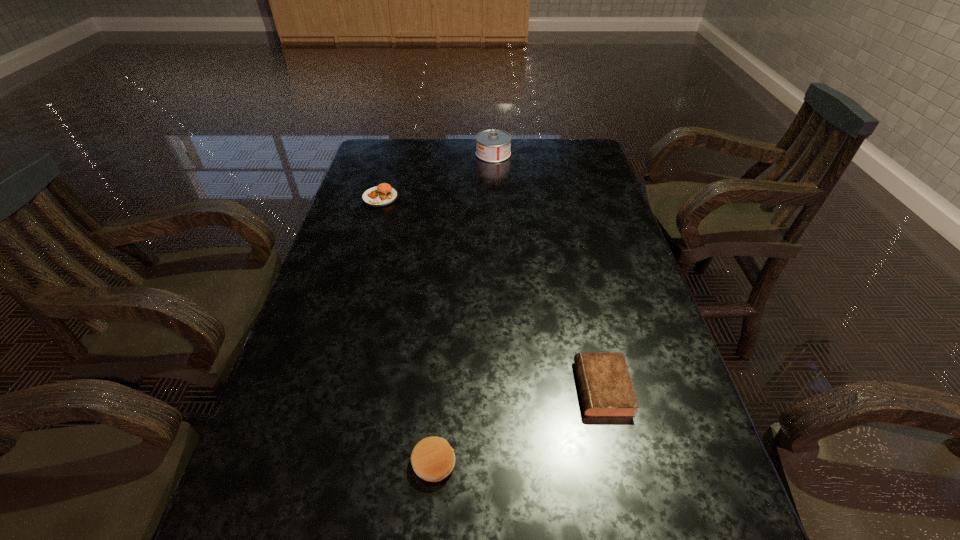
Identify the location of the farthest object. This screenshot has width=960, height=540. (493, 146).

You are a GUI agent. You are given a task and a screenshot of the screen. Output one action in this format:
    pyautogui.click(x=<x>, y=<y>)
    Task: Click on the tallest object
    The width and height of the screenshot is (960, 540).
    Given the screenshot: What is the action you would take?
    click(493, 146)

Find the location of `the left patty`. the left patty is located at coordinates (382, 195).

The width and height of the screenshot is (960, 540). What are the coordinates of `the third nearest object` in the screenshot? It's located at (382, 195).

Where is `the nearest object`? The width and height of the screenshot is (960, 540). the nearest object is located at coordinates (433, 459).

Where is `the right patty`? This screenshot has height=540, width=960. the right patty is located at coordinates (433, 459).

Locate an element on the screen. The height and width of the screenshot is (540, 960). diary is located at coordinates (606, 389).

Image resolution: width=960 pixels, height=540 pixels. I want to click on the rightmost object, so click(x=606, y=389).

Where is `vacant position located 0.110m on the right of the farthest object`? The height and width of the screenshot is (540, 960). vacant position located 0.110m on the right of the farthest object is located at coordinates (540, 154).

Find the location of a particular element. The height and width of the screenshot is (540, 960). vacant space situated 0.100m on the front of the left patty is located at coordinates (372, 227).